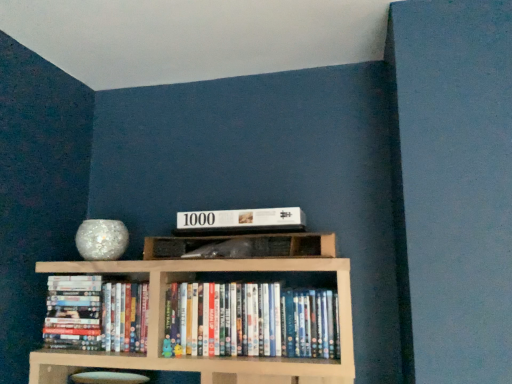
Question: Relative to wooden shelf at center, is hardcover books at center, acting as the 2th book starting from the right, in front or behind?

Choices:
 (A) behind
 (B) front

Answer: (A)

Question: From a real-world perspective, is hardcover books at center, placed as the 1th book when sorted from left to right, above or below wooden shelf at center?

Choices:
 (A) above
 (B) below

Answer: (B)

Question: Which object is positioned closest to the white glossy dvd case at center, the first book when ordered from right to left?

Choices:
 (A) hardcover books at center, placed as the 1th book when sorted from left to right
 (B) white matte puzzle box at center
 (C) wooden shelf at center

Answer: (C)

Question: Estimate the real-world distances between objects in this image. Which object is closer to the hardcover books at center, acting as the 2th book starting from the right?

Choices:
 (A) white matte puzzle box at center
 (B) white glossy dvd case at center, acting as the 2th book starting from the left
 (C) wooden shelf at center

Answer: (C)